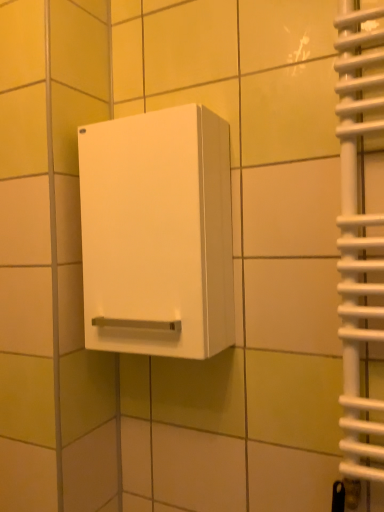
Where is `white matte cabinet at center`? The width and height of the screenshot is (384, 512). white matte cabinet at center is located at coordinates (157, 233).

What do you see at coordinates (157, 233) in the screenshot? I see `white matte cabinet at center` at bounding box center [157, 233].

Where is `white matte cabinet at center`? The height and width of the screenshot is (512, 384). white matte cabinet at center is located at coordinates [x=157, y=233].